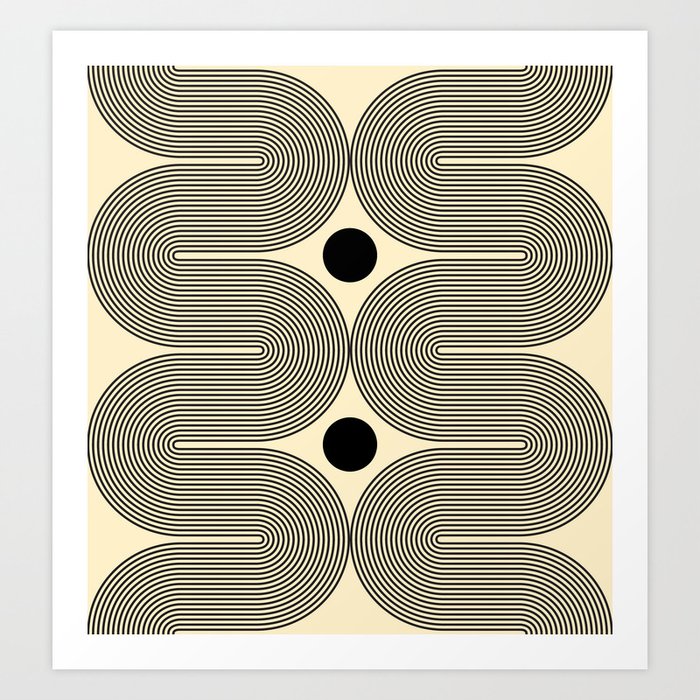
This screenshot has height=700, width=700. Find the location of `artwork`. artwork is located at coordinates (537, 482).